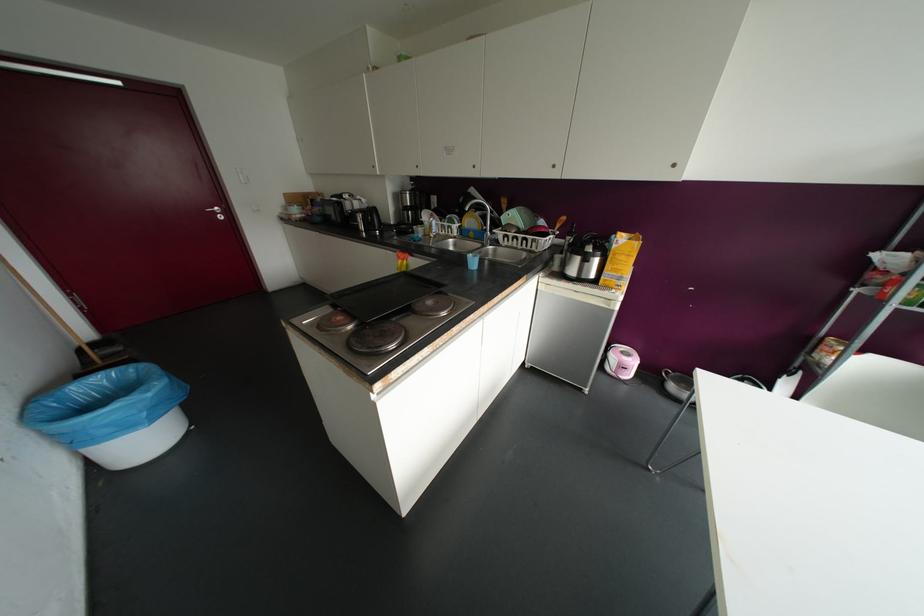
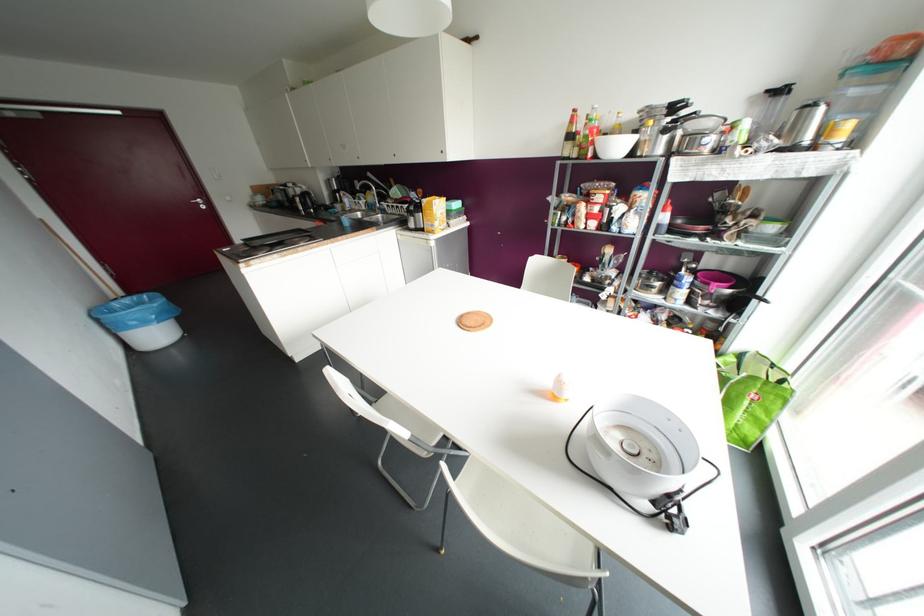
Locate, in the second image, the point that corresponds to pixel 614 246 in the first image.

(421, 204)